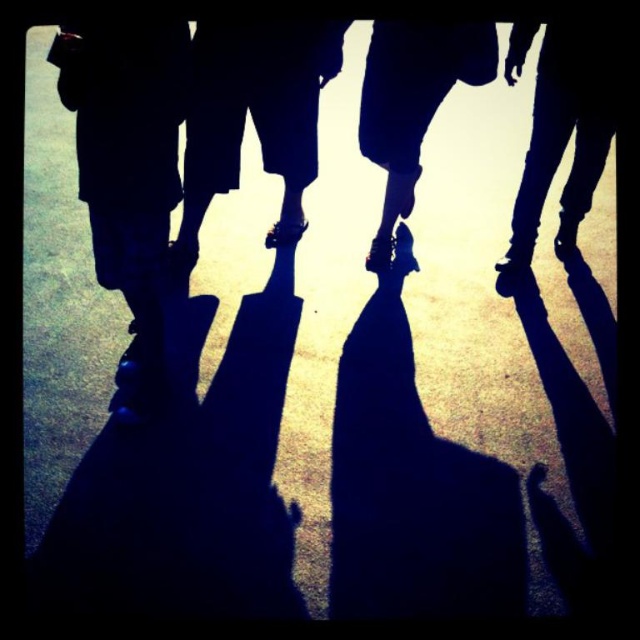
Consider the image. You are standing at the origin point of the image coordinate system. You want to place a small flag at point (x=253, y=115). What object will the flag land on?

The flag will land on the matte black sandals at center because the point (x=253, y=115) is on matte black sandals at center.

You are a photographer trying to capture the shadows of the leather boots at right and the shiny black shoe at center. Which object will cast a wider shadow?

The leather boots at right will cast a wider shadow since their width is larger than the shiny black shoe at center.

You are a photographer trying to capture the matte black sandals at center in your shot. Based on their position, where should you aim your camera?

The matte black sandals at center are located at the 2D coordinates point (x=253, y=115), so aim your camera at that position to capture them.